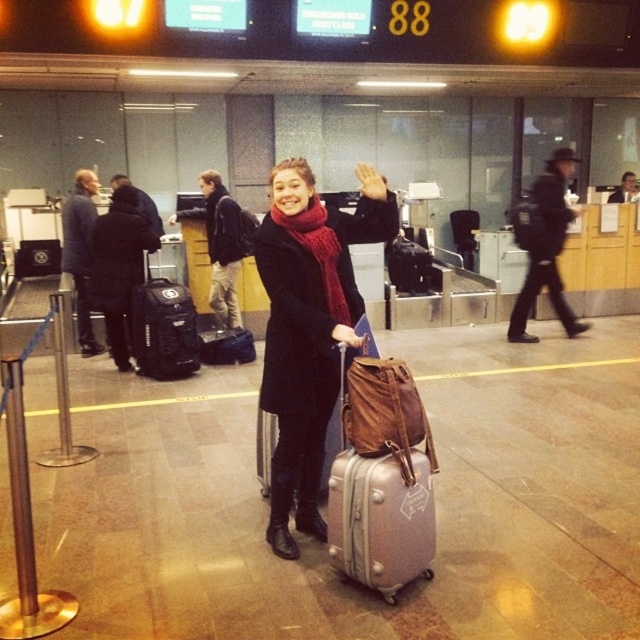
You are a traveler who needs to choose between the black fabric backpack at left and the dark blue backpack at center. Based on their sizes, which one can hold more items?

The dark blue backpack at center can hold more items because it is larger in size compared to the black fabric backpack at left.

You are standing at the entrance of the airport terminal and see the leather backpack at center. If you want to reach it without moving your position, is it within your arm reach?

The leather backpack at center is 8.27 feet from camera. Since the average arm reach is about 2.5 feet, it is too far to reach without moving closer.